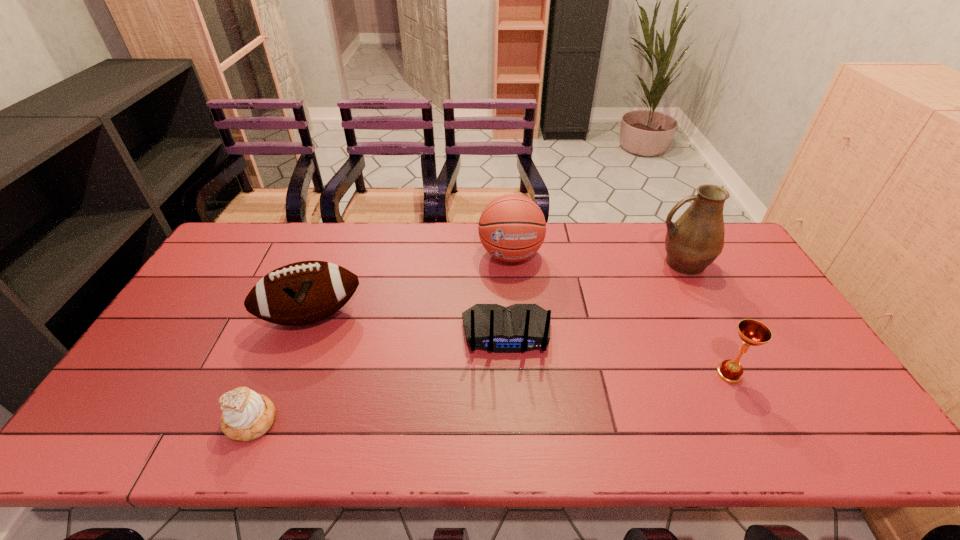
This screenshot has height=540, width=960. I want to click on vacant space located on the logo side of the basketball, so click(516, 315).

Where is `free space located 0.200m on the back of the football (American)`? free space located 0.200m on the back of the football (American) is located at coordinates (336, 252).

The height and width of the screenshot is (540, 960). I want to click on free region located 0.210m on the back of the router, so click(x=513, y=431).

Identify the location of vacant space located 0.240m on the left of the second nearest object. Image resolution: width=960 pixels, height=540 pixels. (621, 374).

In order to click on vacant space located 0.190m on the right of the shortest object in this screenshot , I will do coord(358,421).

Locate an element on the screen. pitcher that is at the far edge is located at coordinates (696, 239).

Identify the location of basketball positioned at the far edge. (512, 228).

Where is `object located in the near edge section of the desktop`? object located in the near edge section of the desktop is located at coordinates (247, 415).

The height and width of the screenshot is (540, 960). I want to click on object present at the right edge, so coord(696,239).

The height and width of the screenshot is (540, 960). What are the coordinates of `object located at the far right corner` in the screenshot? It's located at pyautogui.click(x=696, y=239).